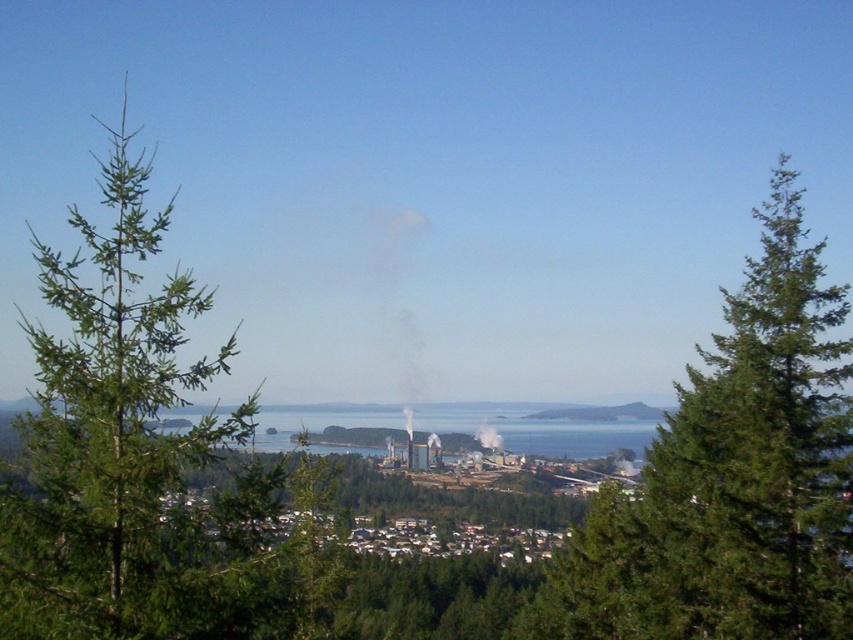
You are a drone operator trying to navigate between two points in the image. The first point is at coordinate point (x=743, y=317) and the second is at coordinate point (x=138, y=596). Which point is closer to your current position if you are at the same elevation as the drone?

Point (x=138, y=596) is closer to your current position because it is less further to the viewer than point (x=743, y=317).